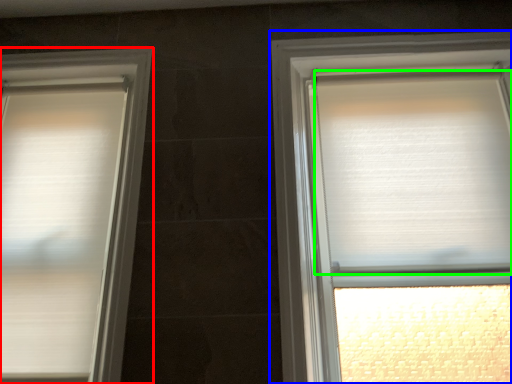
Question: Which object is positioned farthest from window (highlighted by a red box)? Select from window (highlighted by a blue box) and blind (highlighted by a green box).

Choices:
 (A) window
 (B) blind

Answer: (B)